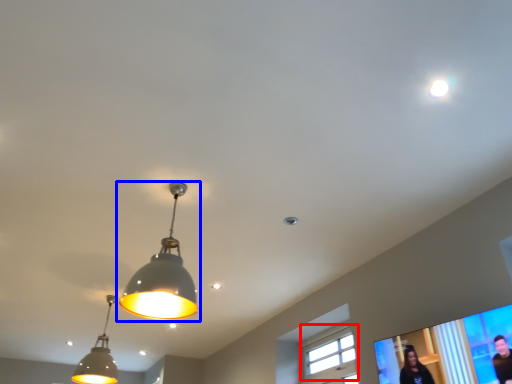
Question: Among these objects, which one is farthest to the camera, window (highlighted by a red box) or lamp (highlighted by a blue box)?

Choices:
 (A) window
 (B) lamp

Answer: (A)